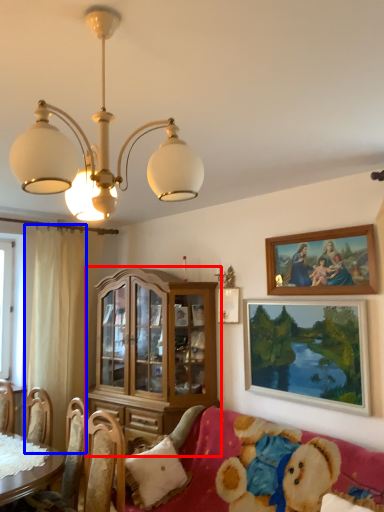
Question: Which object appears closest to the camera in this image, cabinetry (highlighted by a red box) or curtain (highlighted by a blue box)?

Choices:
 (A) cabinetry
 (B) curtain

Answer: (A)